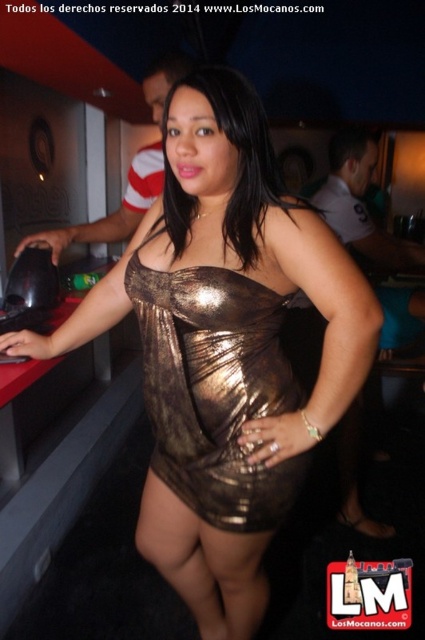
Question: Which point appears farthest from the camera in this image?

Choices:
 (A) (138, 285)
 (B) (76, 232)

Answer: (B)

Question: Which object appears closest to the camera in this image?

Choices:
 (A) shiny metallic dress at center
 (B) metallic gold dress at center

Answer: (A)

Question: Among these objects, which one is nearest to the camera?

Choices:
 (A) shiny metallic dress at center
 (B) metallic gold dress at center

Answer: (A)

Question: Can you confirm if shiny metallic dress at center is wider than metallic gold dress at center?

Choices:
 (A) no
 (B) yes

Answer: (A)

Question: Does shiny metallic dress at center lie in front of metallic gold dress at center?

Choices:
 (A) no
 (B) yes

Answer: (B)

Question: Is shiny metallic dress at center further to camera compared to metallic gold dress at center?

Choices:
 (A) no
 (B) yes

Answer: (A)